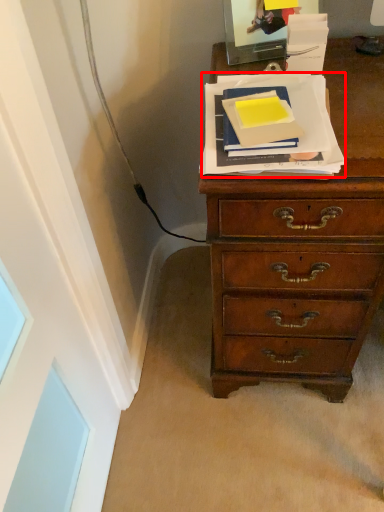
Question: In this image, where is paperback book (annotated by the red box) located relative to paperback book?

Choices:
 (A) right
 (B) left

Answer: (A)